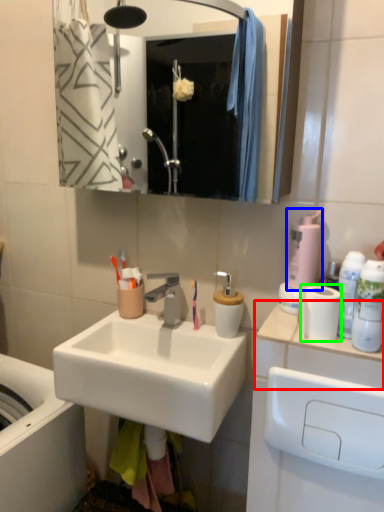
Question: Estimate the real-world distances between objects in this image. Which object is farther from counter top (highlighted by a red box), soap dispenser (highlighted by a blue box) or toilet paper (highlighted by a green box)?

Choices:
 (A) soap dispenser
 (B) toilet paper

Answer: (A)